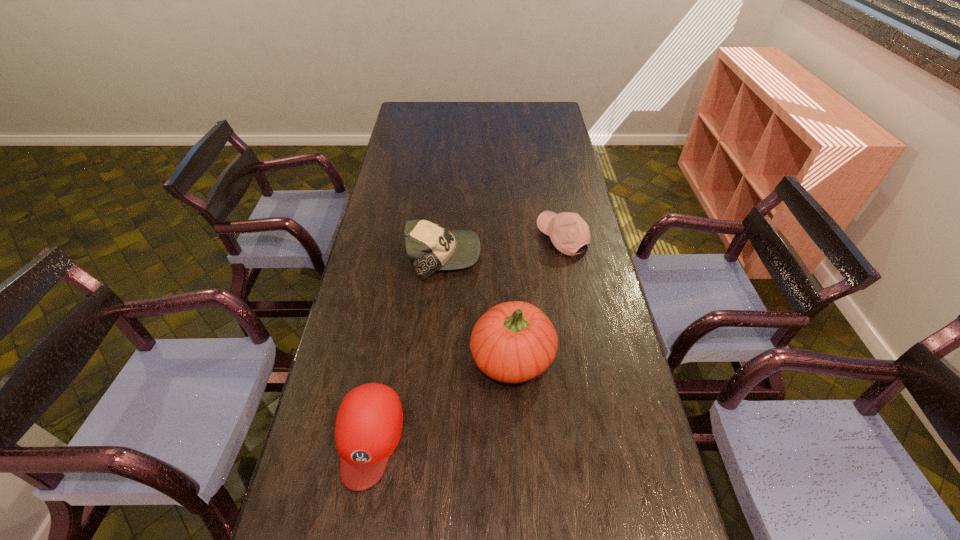
In order to click on unoccupied area between the pumpkin and the nearest baseball cap in this screenshot , I will do click(441, 397).

I want to click on free space between the nearest baseball cap and the pumpkin, so click(441, 397).

At what (x,y) coordinates should I click in order to perform the action: click on vacant space in between the rightmost baseball cap and the nearest baseball cap. Please return your answer as a coordinate pair (x, y). This screenshot has height=540, width=960. Looking at the image, I should click on (466, 338).

Select which object appears as the third closest to the rightmost baseball cap. Please provide its 2D coordinates. Your answer should be formatted as a tuple, i.e. [(x, y)], where the tuple contains the x and y coordinates of a point satisfying the conditions above.

[(369, 422)]

At what (x,y) coordinates should I click in order to perform the action: click on object that stands as the second closest to the rightmost baseball cap. Please return your answer as a coordinate pair (x, y). Looking at the image, I should click on (513, 342).

Identify which baseball cap is the third closest to the pumpkin. Please provide its 2D coordinates. Your answer should be formatted as a tuple, i.e. [(x, y)], where the tuple contains the x and y coordinates of a point satisfying the conditions above.

[(568, 232)]

Locate which baseball cap ranks third in proximity to the pumpkin. Please provide its 2D coordinates. Your answer should be formatted as a tuple, i.e. [(x, y)], where the tuple contains the x and y coordinates of a point satisfying the conditions above.

[(568, 232)]

Where is `vacant space that satisfies the following two spatial constraints: 1. on the front-facing side of the rightmost baseball cap; 2. on the front-facing side of the nearest baseball cap`? The image size is (960, 540). vacant space that satisfies the following two spatial constraints: 1. on the front-facing side of the rightmost baseball cap; 2. on the front-facing side of the nearest baseball cap is located at coordinates (602, 437).

You are a GUI agent. You are given a task and a screenshot of the screen. Output one action in this format:
    pyautogui.click(x=<x>, y=<y>)
    Task: Click on the vacant space that satisfies the following two spatial constraints: 1. on the front-facing side of the rightmost baseball cap; 2. on the front-facing side of the nearest baseball cap
    
    Given the screenshot: What is the action you would take?
    pyautogui.click(x=602, y=437)

This screenshot has width=960, height=540. I want to click on free spot that satisfies the following two spatial constraints: 1. on the front-facing side of the rightmost baseball cap; 2. on the front-facing side of the nearest baseball cap, so pyautogui.click(x=602, y=437).